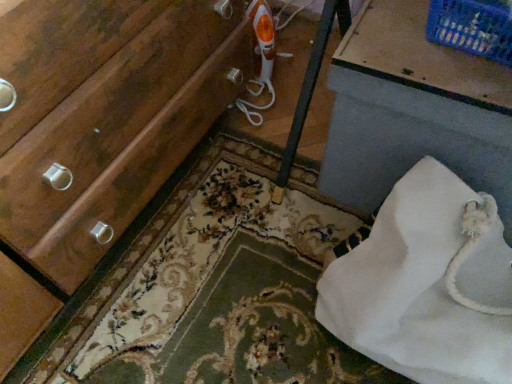
Question: Is blue plastic basket at upper right smaller than floral carpet at lower center?

Choices:
 (A) no
 (B) yes

Answer: (B)

Question: From the image's perspective, is blue plastic basket at upper right under floral carpet at lower center?

Choices:
 (A) no
 (B) yes

Answer: (A)

Question: Can you confirm if blue plastic basket at upper right is shorter than floral carpet at lower center?

Choices:
 (A) yes
 (B) no

Answer: (B)

Question: From a real-world perspective, is blue plastic basket at upper right on top of floral carpet at lower center?

Choices:
 (A) no
 (B) yes

Answer: (B)

Question: Can you confirm if blue plastic basket at upper right is taller than floral carpet at lower center?

Choices:
 (A) yes
 (B) no

Answer: (A)

Question: In terms of height, does blue plastic basket at upper right look taller or shorter compared to white fabric bag at lower right?

Choices:
 (A) tall
 (B) short

Answer: (B)

Question: From the image's perspective, relative to white fabric bag at lower right, is blue plastic basket at upper right above or below?

Choices:
 (A) below
 (B) above

Answer: (B)

Question: Is point (458, 18) closer or farther from the camera than point (352, 79)?

Choices:
 (A) closer
 (B) farther

Answer: (A)

Question: Visually, is blue plastic basket at upper right positioned to the left or to the right of white fabric bag at lower right?

Choices:
 (A) right
 (B) left

Answer: (B)

Question: Is floral carpet at lower center spatially inside blue plastic basket at upper right, or outside of it?

Choices:
 (A) outside
 (B) inside

Answer: (A)

Question: From a real-world perspective, is floral carpet at lower center positioned above or below blue plastic basket at upper right?

Choices:
 (A) above
 (B) below

Answer: (B)

Question: In terms of height, does floral carpet at lower center look taller or shorter compared to blue plastic basket at upper right?

Choices:
 (A) short
 (B) tall

Answer: (A)

Question: Is floral carpet at lower center bigger or smaller than blue plastic basket at upper right?

Choices:
 (A) small
 (B) big

Answer: (B)

Question: In terms of size, does white fabric bag at lower right appear bigger or smaller than floral carpet at lower center?

Choices:
 (A) small
 (B) big

Answer: (B)

Question: From the image's perspective, relative to floral carpet at lower center, is white fabric bag at lower right above or below?

Choices:
 (A) above
 (B) below

Answer: (A)